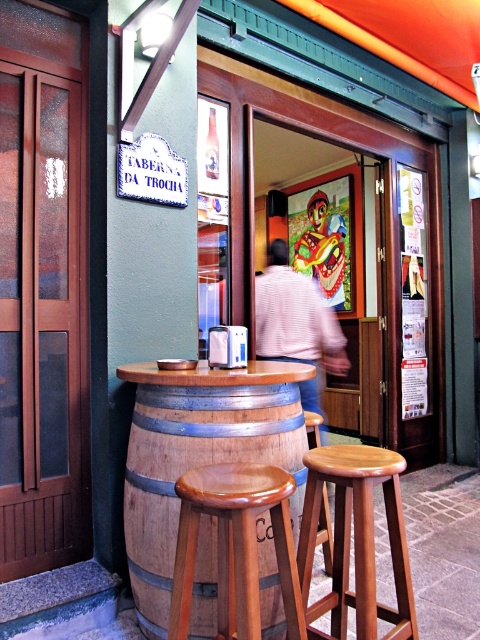
Does light pink sweater at center appear under matte plastic mask at center?

Yes, light pink sweater at center is below matte plastic mask at center.

Is light pink sweater at center to the left of matte plastic mask at center from the viewer's perspective?

Yes, light pink sweater at center is to the left of matte plastic mask at center.

Identify the location of light pink sweater at center. The height and width of the screenshot is (640, 480). (297, 324).

Is shiny brown wood stool at center taller than wooden bar stool at center?

No, shiny brown wood stool at center is not taller than wooden bar stool at center.

This screenshot has height=640, width=480. Find the location of `shiny brown wood stool at center`. shiny brown wood stool at center is located at coordinates (236, 547).

Which of these two, shiny brown wood stool at center or light pink sweater at center, stands taller?

light pink sweater at center is taller.

Can you confirm if shiny brown wood stool at center is bigger than light pink sweater at center?

Actually, shiny brown wood stool at center might be smaller than light pink sweater at center.

Is point (253, 609) less distant than point (269, 328)?

Yes, it is.

This screenshot has height=640, width=480. I want to click on shiny brown wood stool at center, so point(236,547).